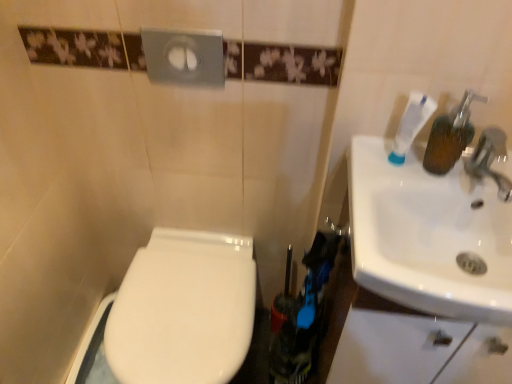
Question: Is white glossy sink at right oriented away from white glossy toilet at lower left?

Choices:
 (A) yes
 (B) no

Answer: (B)

Question: Is white glossy toilet at lower left located within white glossy sink at right?

Choices:
 (A) no
 (B) yes

Answer: (A)

Question: Does white glossy sink at right turn towards white glossy toilet at lower left?

Choices:
 (A) no
 (B) yes

Answer: (A)

Question: Is white glossy sink at right at the left side of white glossy toilet at lower left?

Choices:
 (A) no
 (B) yes

Answer: (A)

Question: Is white glossy sink at right bigger than white glossy toilet at lower left?

Choices:
 (A) yes
 (B) no

Answer: (B)

Question: From a real-world perspective, is white glossy toilet at lower left physically located above or below white glossy sink at right?

Choices:
 (A) above
 (B) below

Answer: (B)

Question: Do you think white glossy toilet at lower left is within white glossy sink at right, or outside of it?

Choices:
 (A) inside
 (B) outside

Answer: (B)

Question: Visually, is white glossy toilet at lower left positioned to the left or to the right of white glossy sink at right?

Choices:
 (A) right
 (B) left

Answer: (B)

Question: In terms of height, does white glossy toilet at lower left look taller or shorter compared to white glossy sink at right?

Choices:
 (A) short
 (B) tall

Answer: (B)

Question: Is point (476, 188) closer or farther from the camera than point (394, 163)?

Choices:
 (A) farther
 (B) closer

Answer: (B)

Question: In terms of width, does white glossy sink at right look wider or thinner when compared to white matte toothpaste at upper right?

Choices:
 (A) wide
 (B) thin

Answer: (A)

Question: From the image's perspective, is white glossy sink at right above or below white matte toothpaste at upper right?

Choices:
 (A) below
 (B) above

Answer: (A)

Question: Based on their positions, is white glossy sink at right located to the left or right of white matte toothpaste at upper right?

Choices:
 (A) left
 (B) right

Answer: (B)

Question: Is white glossy sink at right to the left or to the right of white glossy toilet at lower left in the image?

Choices:
 (A) left
 (B) right

Answer: (B)

Question: From their relative heights in the image, would you say white glossy sink at right is taller or shorter than white glossy toilet at lower left?

Choices:
 (A) short
 (B) tall

Answer: (A)